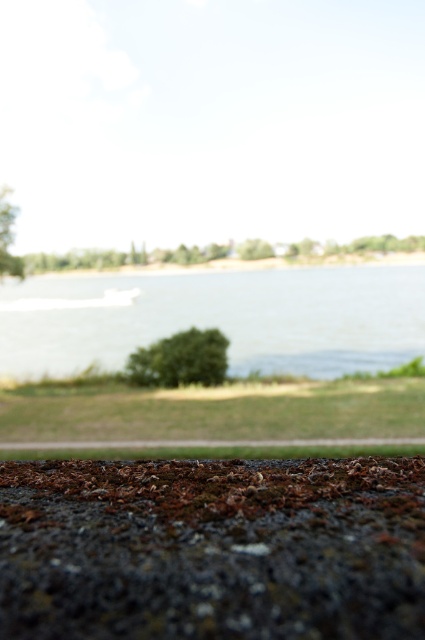
You are standing on the textured surface in the foreground and want to walk to the clear water at center. Which direction should you move relative to the brown gravel curb at lower center?

You should move to the left of the brown gravel curb at lower center to reach the clear water at center since the clear water at center is located to the left of the brown gravel curb at lower center.

You are standing at the edge of the water and want to reach the clear water at center. Which direction should you move to get there?

The clear water at center is located at point coordinates (218, 317), so you should move forward slightly to reach it since you are already at the edge near the center.

You are standing at the edge of the water in the serene outdoor scene. You notice two points marked in the image. If you were to walk from the water towards the paved area covered with dried leaves and moss, which point would you encounter first, point (39, 371) or point (0, 445)?

Point (0, 445) would be encountered first because it is closer to the water edge compared to point (39, 371), which is located behind it.